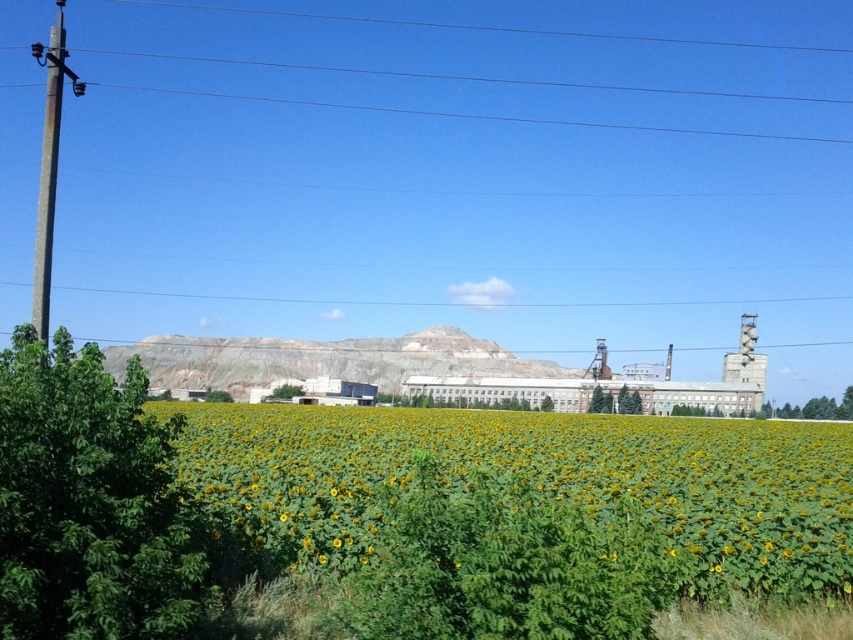
Question: Which point is closer to the camera taking this photo?

Choices:
 (A) (241, 540)
 (B) (47, 284)

Answer: (A)

Question: Where is yellow-green leafy field at center located in relation to smooth gray pole at left in the image?

Choices:
 (A) right
 (B) left

Answer: (A)

Question: Can you confirm if yellow-green leafy field at center is positioned to the right of smooth gray pole at left?

Choices:
 (A) no
 (B) yes

Answer: (B)

Question: Is yellow-green leafy field at center bigger than smooth gray pole at left?

Choices:
 (A) yes
 (B) no

Answer: (B)

Question: Which point appears closest to the camera in this image?

Choices:
 (A) (47, 214)
 (B) (682, 509)

Answer: (B)

Question: Which object appears closest to the camera in this image?

Choices:
 (A) yellow-green leafy field at center
 (B) smooth gray pole at left

Answer: (A)